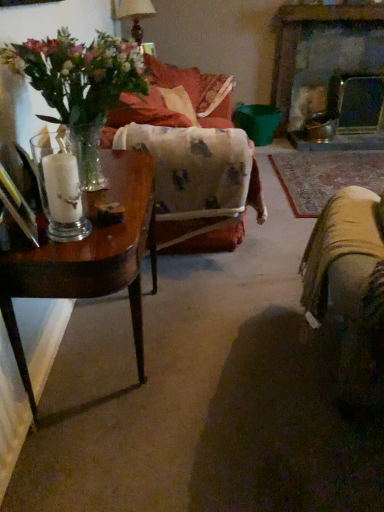
Locate an element on the screen. free space above wooden table at left (from a real-world perspective) is located at coordinates (113, 184).